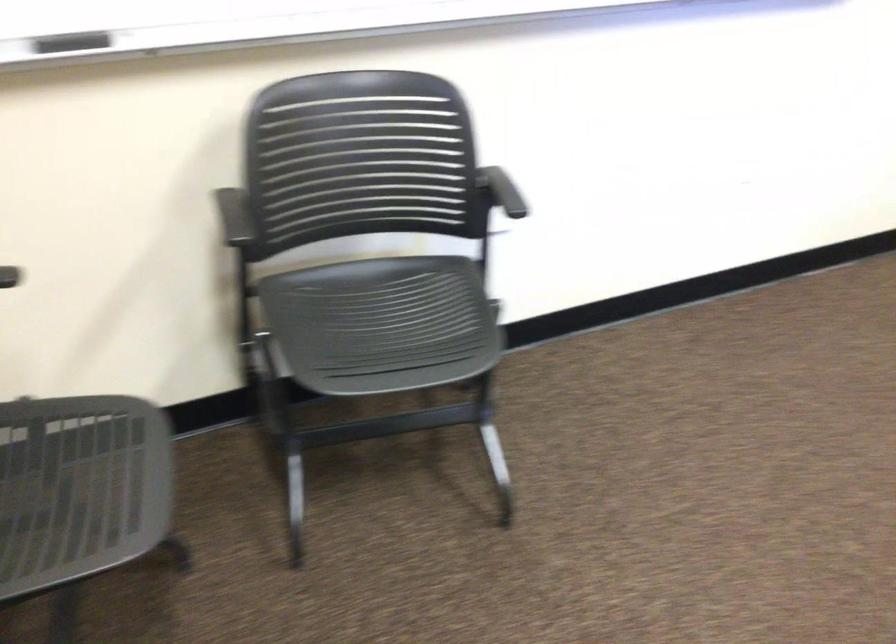
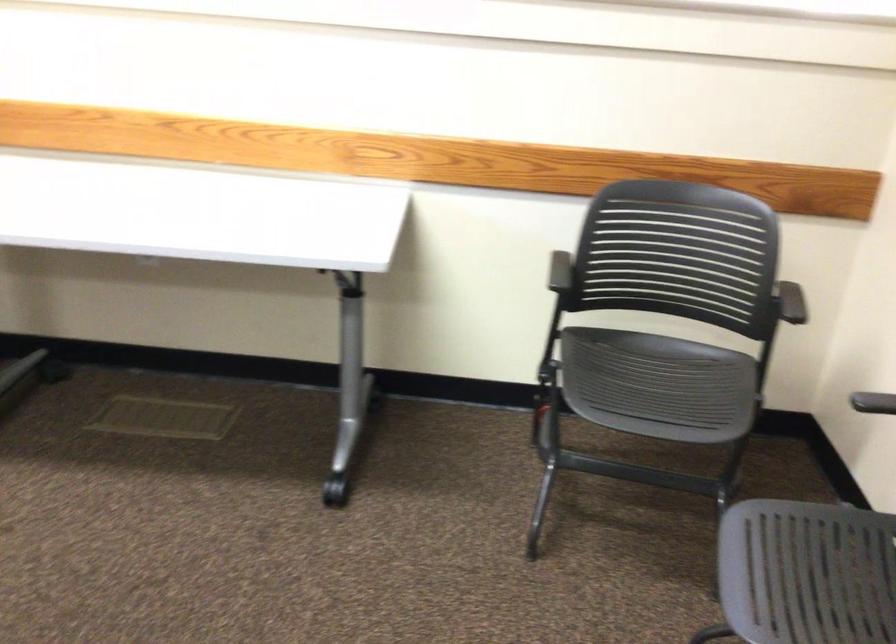
Where in the second image is the point corresponding to point 243,228 from the first image?

(873, 402)